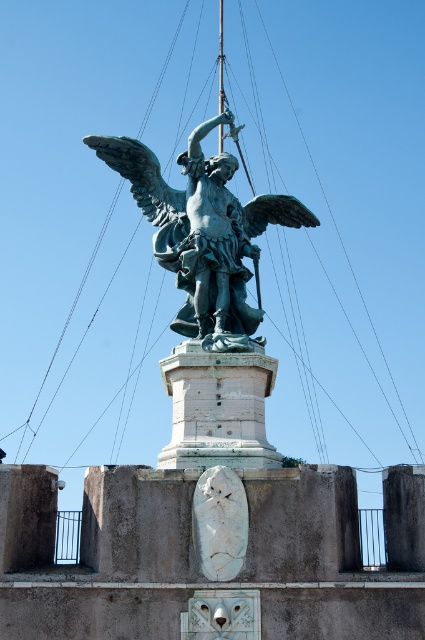
You are a maintenance worker needing to clean the green patina statue at center and the white stone pedestal at center. You have a ladder that can reach up to 6 meters. Can you safely clean both objects without needing a taller ladder?

The green patina statue at center and white stone pedestal at center are 6.84 meters apart from each other. Since the ladder can only reach up to 6 meters, you cannot safely clean both objects without needing a taller ladder.

You are an art conservator examining the statue and pedestal. From your vantage point, does the white stone pedestal at center appear to be in front of or behind the green patina statue at center?

The white stone pedestal at center is behind the green patina statue at center, so it appears to be positioned behind the statue.